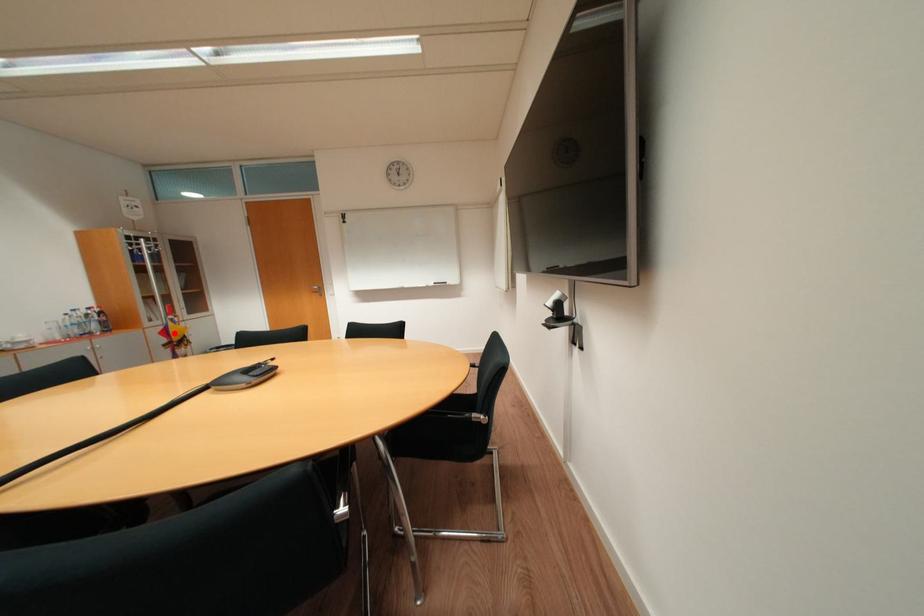
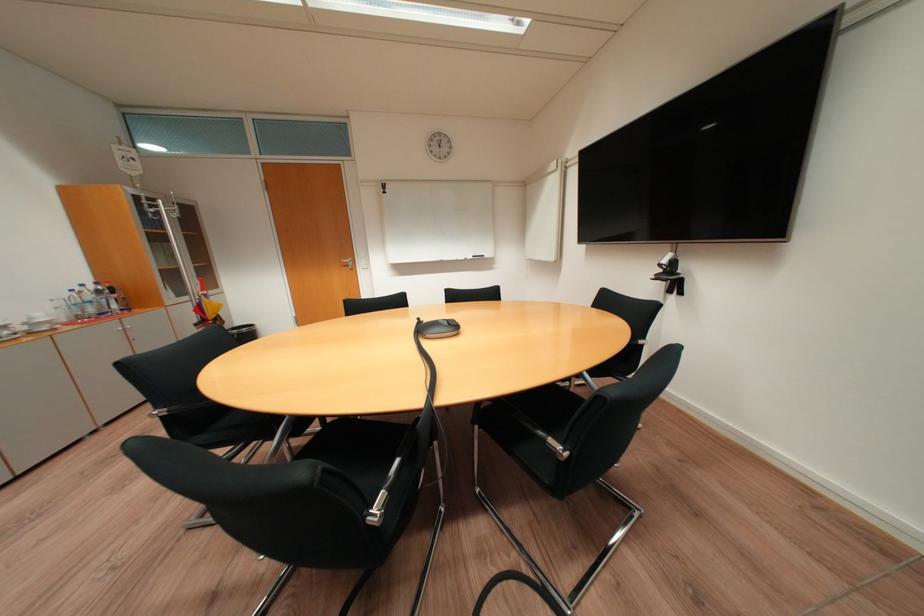
Find the pixel in the second image that matches the highlighted location in the first image.

(208, 310)